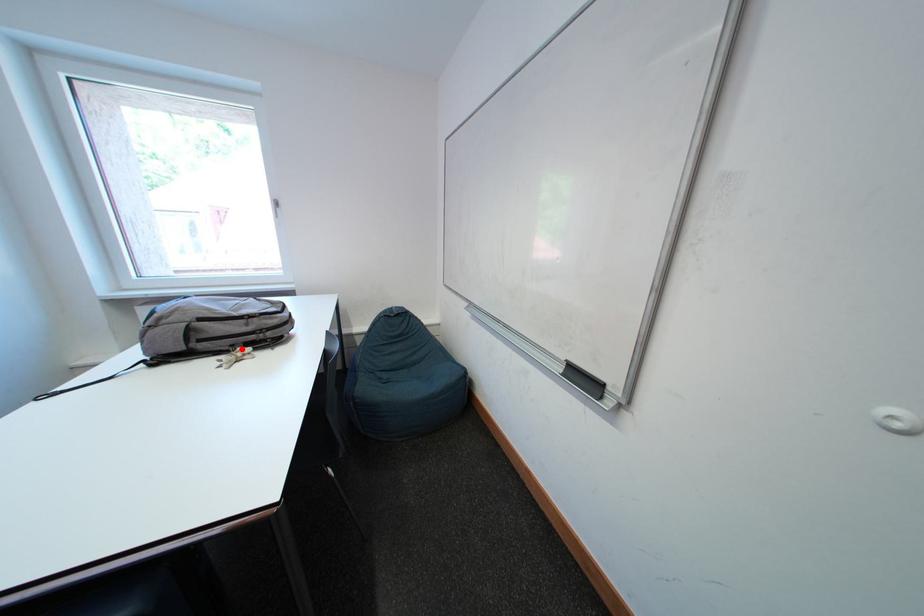
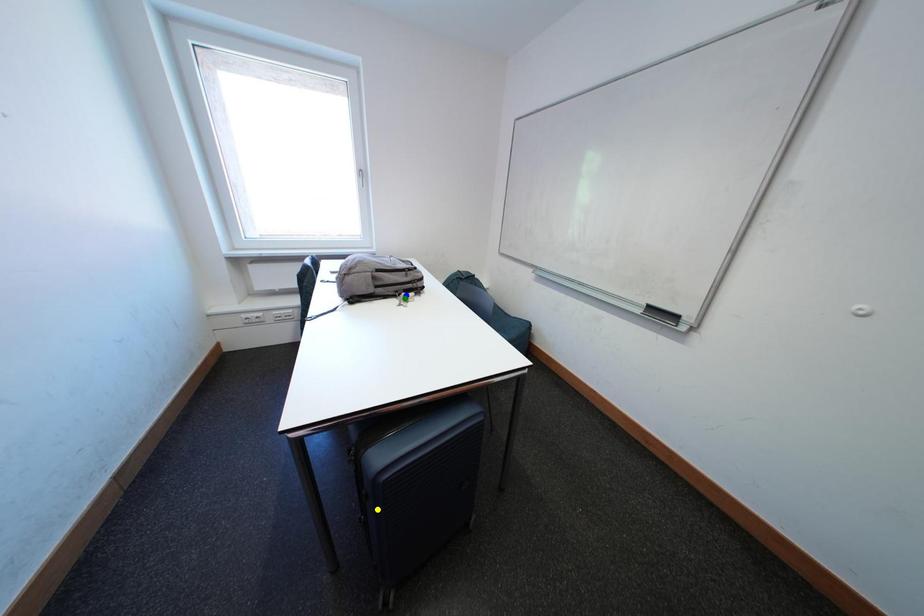
Question: I am providing you with two images of the same scene from different viewpoints. A red point is marked on the first image. You are given multiple points on the second image. Which point in image 2 is actually the same real-world point as the red point in image 1?

Choices:
 (A) blue point
 (B) yellow point
 (C) green point

Answer: (A)